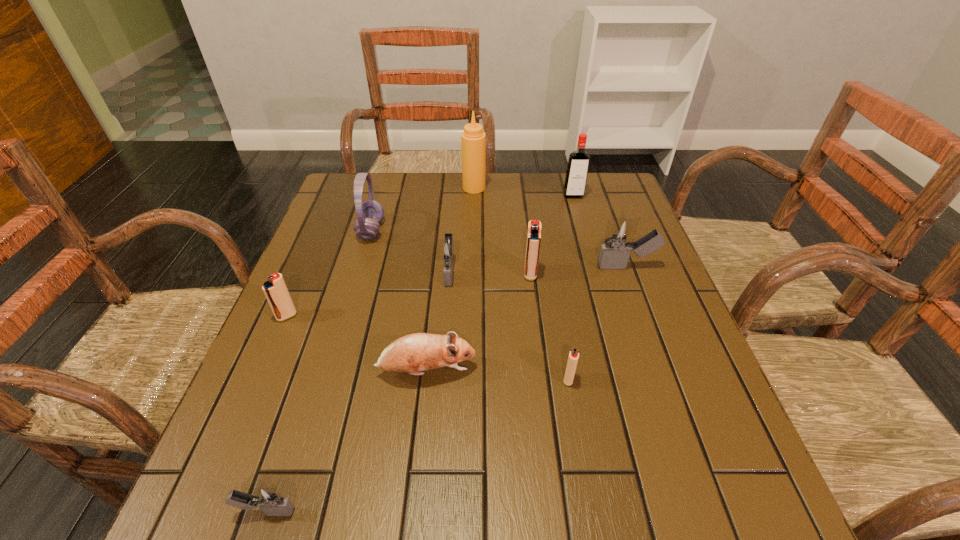
This screenshot has width=960, height=540. I want to click on vacant space that's between the third farthest object and the brown hamster, so click(x=398, y=301).

Locate an element on the screen. vacant point located between the rightmost igniter and the vodka is located at coordinates (600, 231).

The height and width of the screenshot is (540, 960). What are the coordinates of `the seventh closest object relative to the condiment` in the screenshot? It's located at (413, 353).

Where is `the fifth closest object to the third igniter from left to right`? This screenshot has height=540, width=960. the fifth closest object to the third igniter from left to right is located at coordinates (275, 290).

In order to click on igniter identified as the sixth closest to the red vodka in this screenshot , I will do `click(269, 500)`.

Identify which igniter is the second nearest to the fourth object from right to left. Please provide its 2D coordinates. Your answer should be formatted as a tuple, i.e. [(x, y)], where the tuple contains the x and y coordinates of a point satisfying the conditions above.

[(620, 232)]

Identify the location of red igniter object that ranks as the closest to the seventh object from left to right. This screenshot has height=540, width=960. (573, 357).

Identify the location of red igniter identified as the second closest to the biggest gray igniter. (573, 357).

Identify the location of gray igniter identified as the second closest to the fifth igniter from right to left. (620, 232).

This screenshot has height=540, width=960. Identify the location of the second closest gray igniter relative to the brown hamster. 269,500.